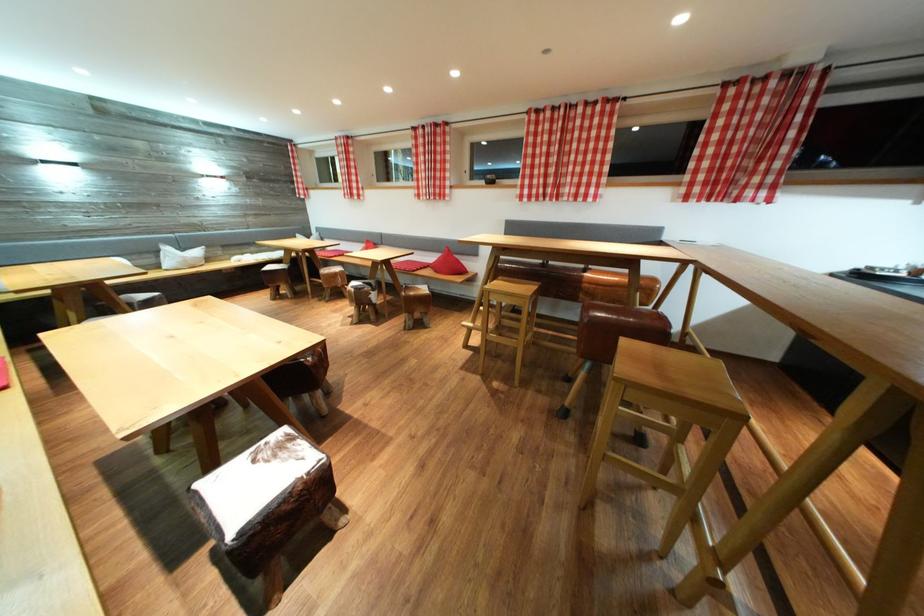
I want to click on white pillow bag, so click(x=180, y=257).